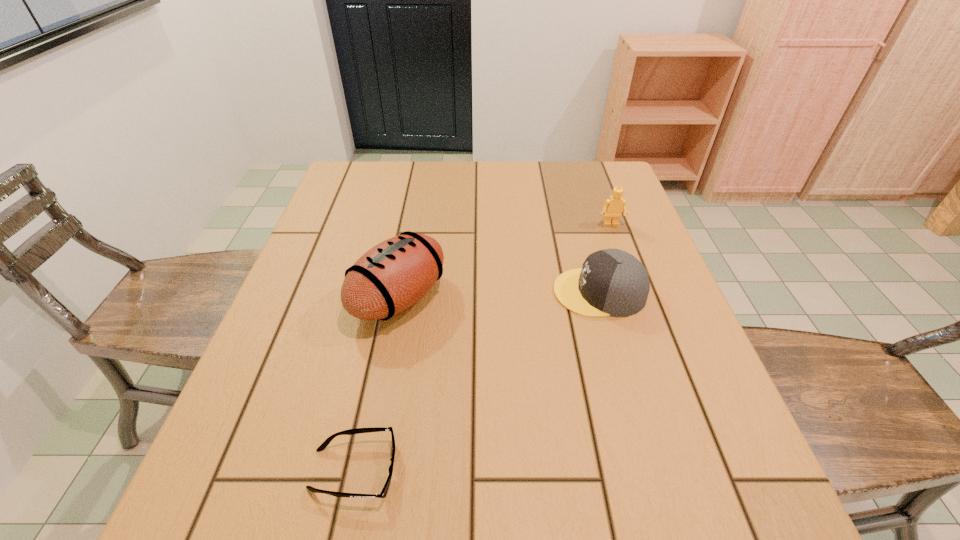
Where is `vacant space in between the third shortest object and the football (American)`? Image resolution: width=960 pixels, height=540 pixels. vacant space in between the third shortest object and the football (American) is located at coordinates (505, 261).

Find the location of `free point between the football (American) and the nearest object`. free point between the football (American) and the nearest object is located at coordinates (376, 384).

Point out which object is positioned as the third nearest to the Lego. Please provide its 2D coordinates. Your answer should be formatted as a tuple, i.e. [(x, y)], where the tuple contains the x and y coordinates of a point satisfying the conditions above.

[(383, 493)]

Identify which object is located as the third nearest to the nearest object. Please provide its 2D coordinates. Your answer should be formatted as a tuple, i.e. [(x, y)], where the tuple contains the x and y coordinates of a point satisfying the conditions above.

[(613, 207)]

Where is `free location that satisfies the following two spatial constraints: 1. on the face of the Lego; 2. on the front-facing side of the shortest object`? free location that satisfies the following two spatial constraints: 1. on the face of the Lego; 2. on the front-facing side of the shortest object is located at coordinates (701, 469).

You are a GUI agent. You are given a task and a screenshot of the screen. Output one action in this format:
    pyautogui.click(x=<x>, y=<y>)
    Task: Click on the free space that satisfies the following two spatial constraints: 1. on the face of the third shortest object; 2. on the front-facing side of the cap
    
    Given the screenshot: What is the action you would take?
    pyautogui.click(x=636, y=292)

Locate an element on the screen. The width and height of the screenshot is (960, 540). free location that satisfies the following two spatial constraints: 1. on the face of the farthest object; 2. on the front-facing side of the third tallest object is located at coordinates (636, 292).

I want to click on vacant area that satisfies the following two spatial constraints: 1. on the face of the third shortest object; 2. on the front-facing side of the sunglasses, so click(701, 469).

What are the coordinates of `free spot that satisfies the following two spatial constraints: 1. on the face of the third shortest object; 2. on the front-facing side of the sunglasses` in the screenshot? It's located at (701, 469).

The image size is (960, 540). In order to click on free location that satisfies the following two spatial constraints: 1. on the face of the second tallest object; 2. on the front-facing side of the second shortest object in this screenshot , I will do `click(636, 292)`.